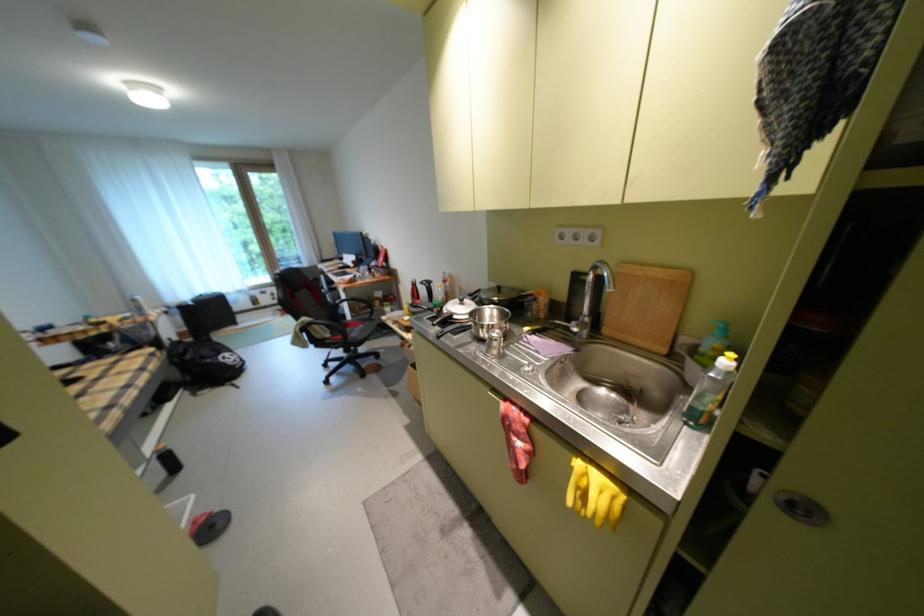
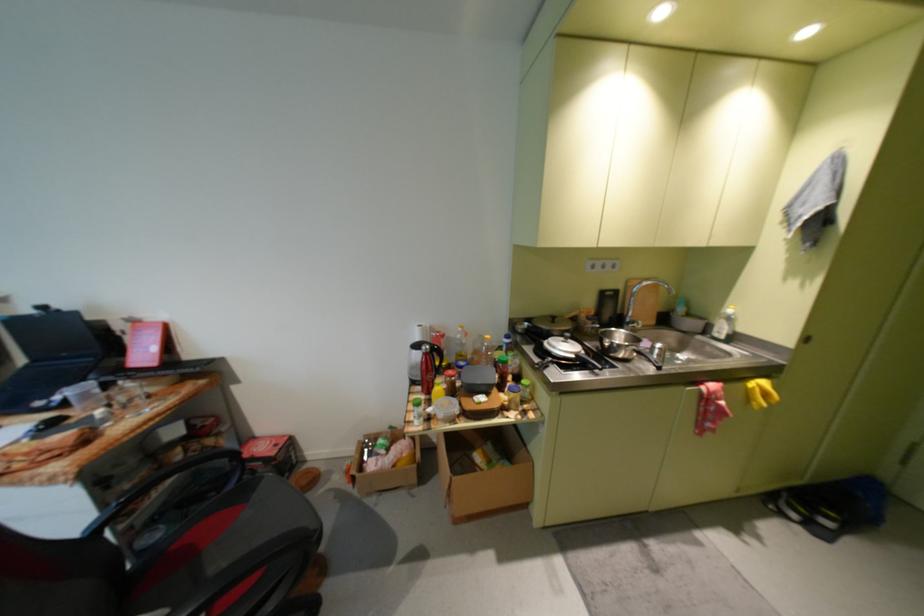
Find the pixel in the second image that matches the point at 457,314 in the first image.

(586, 357)